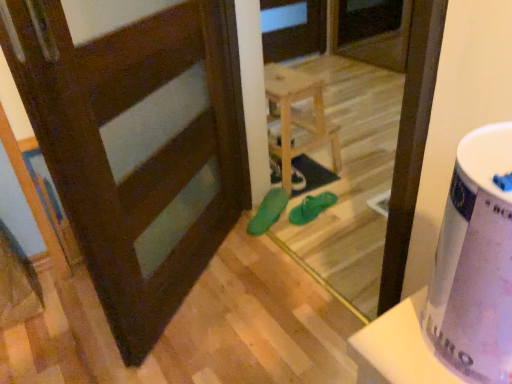
Where is `vacant area to the right of green rubber flip-flops at center, which is counted as the 2th footwear, starting from the left`? The image size is (512, 384). vacant area to the right of green rubber flip-flops at center, which is counted as the 2th footwear, starting from the left is located at coordinates (353, 206).